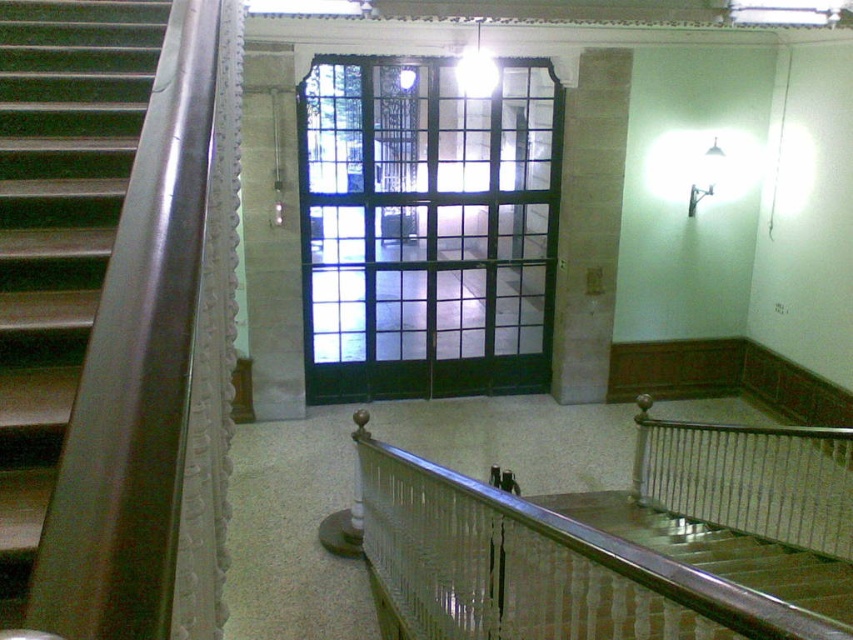
Question: Can you confirm if black glass door at center is thinner than metallic gray stairs at left?

Choices:
 (A) yes
 (B) no

Answer: (B)

Question: Which object is farther from the camera taking this photo?

Choices:
 (A) black glass door at center
 (B) metallic gray stairs at left
 (C) gray stone pillar at center

Answer: (C)

Question: Which object appears closest to the camera in this image?

Choices:
 (A) metallic polished handrail at lower center
 (B) black glass door at center
 (C) gray stone pillar at center

Answer: (A)

Question: Is black glass door at center smaller than gray stone pillar at center?

Choices:
 (A) yes
 (B) no

Answer: (B)

Question: Observing the image, what is the correct spatial positioning of metallic gray stairs at left in reference to gray stone pillar at center?

Choices:
 (A) right
 (B) left

Answer: (B)

Question: Which point is farther to the camera?

Choices:
 (A) black glass door at center
 (B) metallic gray stairs at left

Answer: (A)